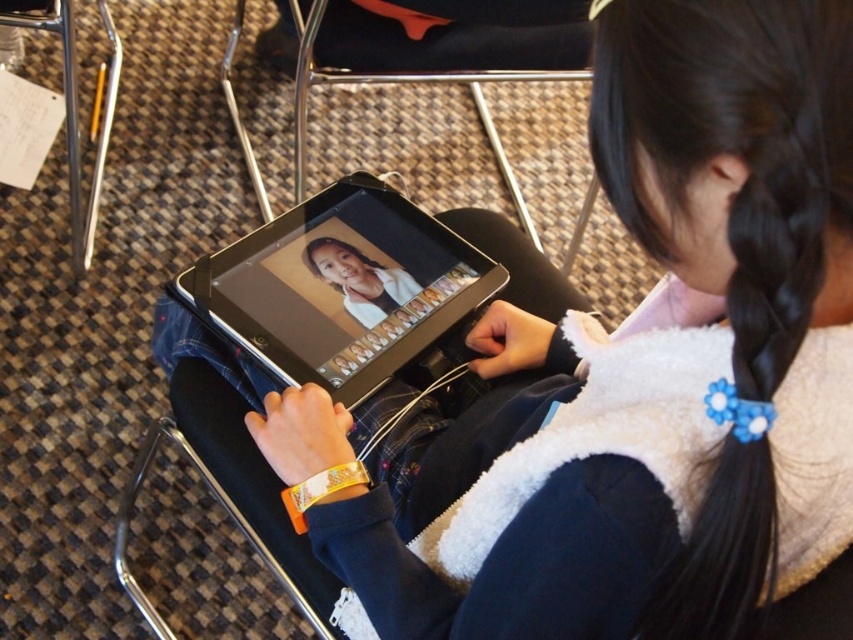
Between point (776, 211) and point (287, 380), which one is positioned in front?

Point (776, 211) is more forward.

Locate an element on the screen. This screenshot has width=853, height=640. white fleece vest at center is located at coordinates (664, 349).

Between point (700, 342) and point (277, 288), which one is positioned behind?

The point (277, 288) is more distant.

Identify the location of white fleece vest at center. The width and height of the screenshot is (853, 640). click(x=664, y=349).

Is point (383, 195) positioned in front of point (524, 272)?

Yes, it is in front of point (524, 272).

Does point (438, 264) come farther from viewer compared to point (270, 493)?

Yes, it is.

The image size is (853, 640). What are the coordinates of `black glossy tablet at center` in the screenshot? It's located at (340, 288).

From the picture: Does white fleece vest at center have a greater width compared to black plastic chair at center?

Yes.

Can you confirm if white fleece vest at center is positioned below black plastic chair at center?

Incorrect, white fleece vest at center is not positioned below black plastic chair at center.

Is point (746, 440) positioned after point (283, 552)?

No, it is not.

Where is `white fleece vest at center`? Image resolution: width=853 pixels, height=640 pixels. white fleece vest at center is located at coordinates (664, 349).